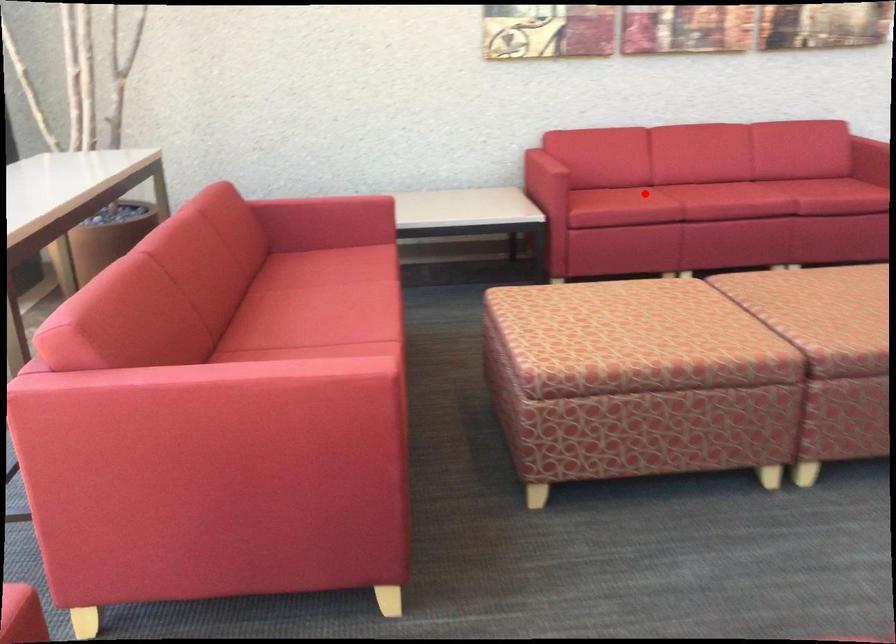
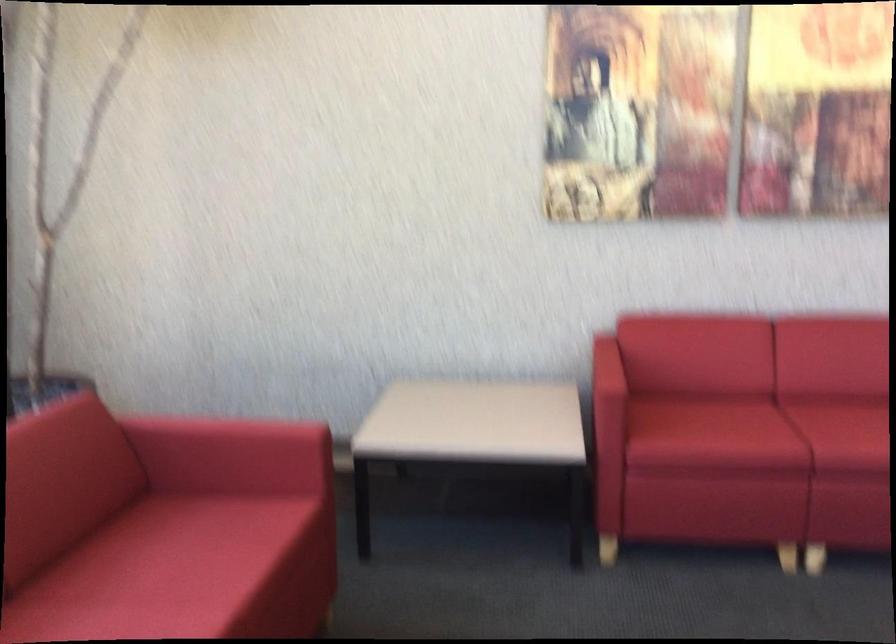
Question: I am providing you with two images of the same scene from different viewpoints. In image1, a red point is highlighted. Considering the same 3D point in image2, which of the following is correct?

Choices:
 (A) It is closer
 (B) It is farther

Answer: (A)